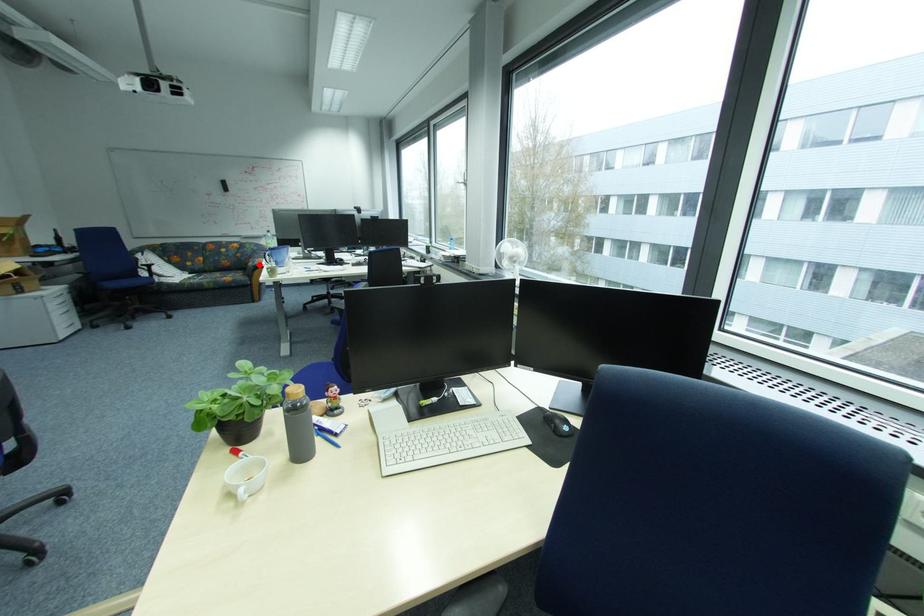
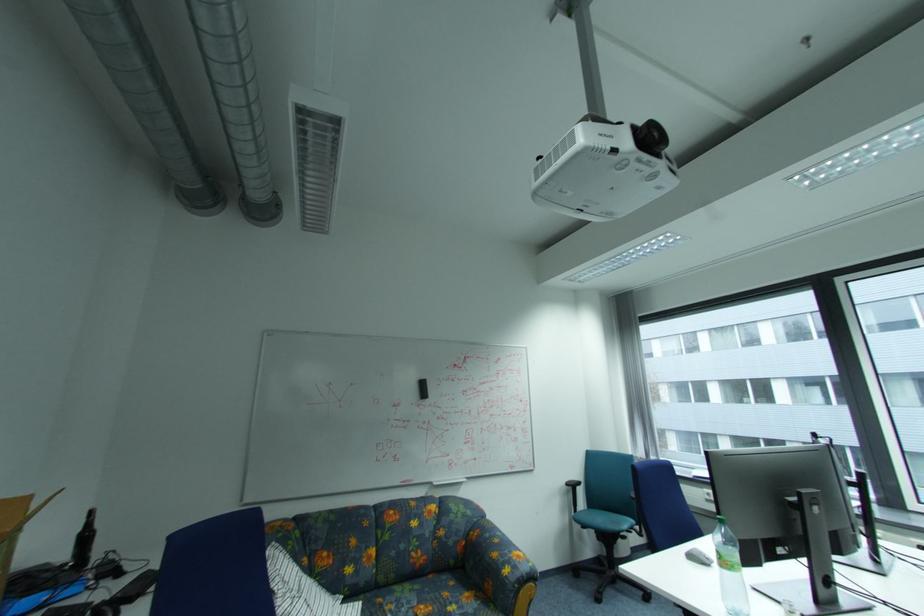
Find the pixel in the second image that matches the highlighted location in the first image.

(515, 572)